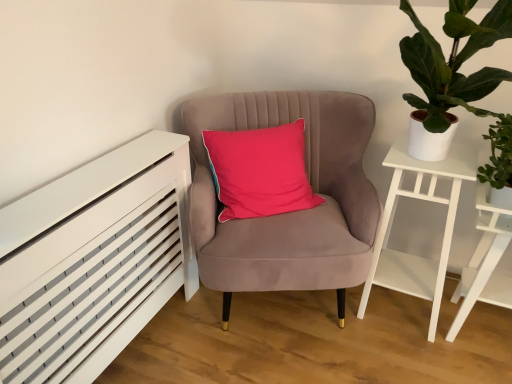
Where is `velvet pink chair at center`? The image size is (512, 384). velvet pink chair at center is located at coordinates (x=291, y=212).

The width and height of the screenshot is (512, 384). Describe the element at coordinates (392, 222) in the screenshot. I see `white matte side table at right` at that location.

In order to click on white wooden side table at right in this screenshot , I will do `click(485, 262)`.

How much distance is there between white matte side table at right and green leafy plant at right?

white matte side table at right is 33.02 centimeters away from green leafy plant at right.

Can you confirm if white matte side table at right is shorter than green leafy plant at right?

No, white matte side table at right is not shorter than green leafy plant at right.

From the image's perspective, who appears lower, white matte side table at right or green leafy plant at right?

white matte side table at right is shown below in the image.

Considering the relative sizes of white matte side table at right and green leafy plant at right in the image provided, is white matte side table at right bigger than green leafy plant at right?

Incorrect, white matte side table at right is not larger than green leafy plant at right.

From the image's perspective, which one is positioned lower, white wooden side table at right or white matte side table at right?

white wooden side table at right is shown below in the image.

Does white wooden side table at right have a greater width compared to white matte side table at right?

Yes, white wooden side table at right is wider than white matte side table at right.

Between white wooden side table at right and white matte side table at right, which one is positioned in front?

white wooden side table at right is more forward.

The image size is (512, 384). Identify the location of nightstand lying behind the white wooden side table at right. (392, 222).

Would you say white wooden side table at right is outside green leafy plant at right?

Yes.

From the image's perspective, which one is positioned higher, white wooden side table at right or green leafy plant at right?

green leafy plant at right.

Is point (477, 199) positioned in front of point (431, 91)?

That is False.

From a real-world perspective, is white wooden side table at right physically located above or below green leafy plant at right?

In terms of real-world spatial position, white wooden side table at right is below green leafy plant at right.

Between white wooden side table at right and velvet pink chair at center, which one has larger width?

Wider between the two is velvet pink chair at center.

From the image's perspective, is white wooden side table at right below velvet pink chair at center?

Correct, white wooden side table at right appears lower than velvet pink chair at center in the image.

Based on the photo, is white wooden side table at right not near velvet pink chair at center?

No, white wooden side table at right is not far away from velvet pink chair at center.

Based on the photo, considering the sizes of white wooden side table at right and velvet pink chair at center in the image, is white wooden side table at right taller or shorter than velvet pink chair at center?

In the image, white wooden side table at right appears to be shorter than velvet pink chair at center.

Looking at this image, between green leafy plant at right and white wooden side table at right, which one has less height?

green leafy plant at right is shorter.

Is green leafy plant at right bigger than white wooden side table at right?

Correct, green leafy plant at right is larger in size than white wooden side table at right.

Do you think green leafy plant at right is within white wooden side table at right, or outside of it?

green leafy plant at right is located beyond the bounds of white wooden side table at right.

Does green leafy plant at right turn towards white matte side table at right?

No, green leafy plant at right does not turn towards white matte side table at right.

Looking at the image, does green leafy plant at right seem bigger or smaller compared to white matte side table at right?

In the image, green leafy plant at right appears to be larger than white matte side table at right.

Can you confirm if green leafy plant at right is positioned to the right of white matte side table at right?

No, green leafy plant at right is not to the right of white matte side table at right.

Is velvet pink chair at center located outside green leafy plant at right?

Absolutely, velvet pink chair at center is external to green leafy plant at right.

Which object is closer to the camera, velvet pink chair at center or green leafy plant at right?

green leafy plant at right.

Is velvet pink chair at center at the right side of green leafy plant at right?

Incorrect, velvet pink chair at center is not on the right side of green leafy plant at right.

Can you tell me how much velvet pink chair at center and green leafy plant at right differ in facing direction?

The facing directions of velvet pink chair at center and green leafy plant at right are 27.6 degrees apart.

Image resolution: width=512 pixels, height=384 pixels. Identify the location of houseplant above the white matte side table at right (from the image's perspective). (450, 71).

Locate an element on the screen. table below the white matte side table at right (from the image's perspective) is located at coordinates (485, 262).

From the image, which object appears to be farther from white matte side table at right, green leafy plant at right or velvet pink chair at center?

velvet pink chair at center is positioned further to the anchor white matte side table at right.

Estimate the real-world distances between objects in this image. Which object is closer to velvet pink chair at center, white wooden side table at right or white matte side table at right?

Among the two, white matte side table at right is located nearer to velvet pink chair at center.

Based on their spatial positions, is white wooden side table at right or green leafy plant at right further from velvet pink chair at center?

The object further to velvet pink chair at center is white wooden side table at right.

When comparing their distances from white matte side table at right, does white wooden side table at right or velvet pink chair at center seem further?

velvet pink chair at center is further to white matte side table at right.

From the image, which object appears to be farther from green leafy plant at right, white wooden side table at right or white matte side table at right?

white wooden side table at right lies further to green leafy plant at right than the other object.

In the scene shown: Estimate the real-world distances between objects in this image. Which object is closer to white wooden side table at right, green leafy plant at right or velvet pink chair at center?

green leafy plant at right lies closer to white wooden side table at right than the other object.

Looking at this image, considering their positions, is white matte side table at right positioned further to velvet pink chair at center than green leafy plant at right?

The object further to velvet pink chair at center is green leafy plant at right.

Based on their spatial positions, is velvet pink chair at center or green leafy plant at right further from white wooden side table at right?

Among the two, velvet pink chair at center is located further to white wooden side table at right.

Where is `houseplant between velvet pink chair at center and white wooden side table at right from left to right`? The image size is (512, 384). houseplant between velvet pink chair at center and white wooden side table at right from left to right is located at coordinates (450, 71).

You are a GUI agent. You are given a task and a screenshot of the screen. Output one action in this format:
    pyautogui.click(x=<x>, y=<y>)
    Task: Click on the nightstand between velvet pink chair at center and white wooden side table at right
    This screenshot has height=384, width=512.
    Given the screenshot: What is the action you would take?
    pyautogui.click(x=392, y=222)

In order to click on nightstand between green leafy plant at right and white wooden side table at right vertically in this screenshot , I will do `click(392, 222)`.

Identify the location of houseplant between velvet pink chair at center and white matte side table at right. This screenshot has height=384, width=512. click(450, 71).